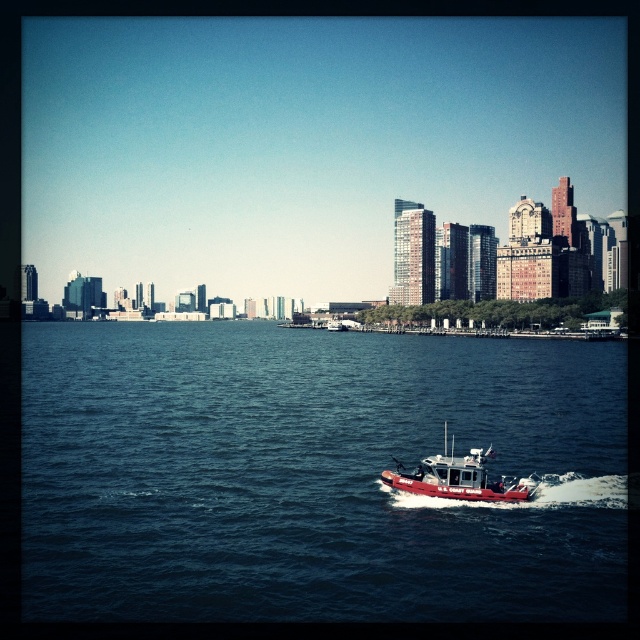
Question: Which point is farther to the camera?

Choices:
 (A) blue water at center
 (B) red matte boat at center

Answer: (B)

Question: Among these points, which one is nearest to the camera?

Choices:
 (A) (186, 570)
 (B) (413, 474)

Answer: (A)

Question: Is blue water at center in front of red matte boat at center?

Choices:
 (A) no
 (B) yes

Answer: (B)

Question: Is the position of blue water at center more distant than that of red matte boat at center?

Choices:
 (A) yes
 (B) no

Answer: (B)

Question: Where is blue water at center located in relation to red matte boat at center in the image?

Choices:
 (A) right
 (B) left

Answer: (B)

Question: Which point is closer to the camera?

Choices:
 (A) (477, 477)
 (B) (173, 376)

Answer: (A)